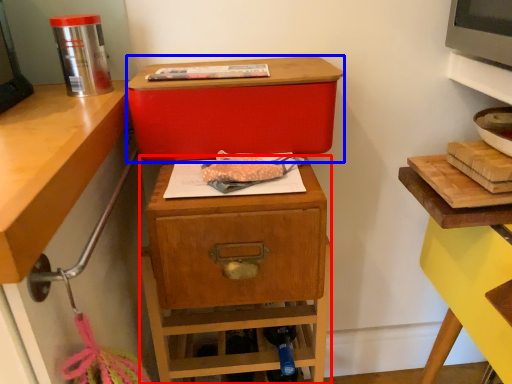
Question: Which point is closer to the camera, nightstand (highlighted by a red box) or storage box (highlighted by a blue box)?

Choices:
 (A) nightstand
 (B) storage box

Answer: (B)